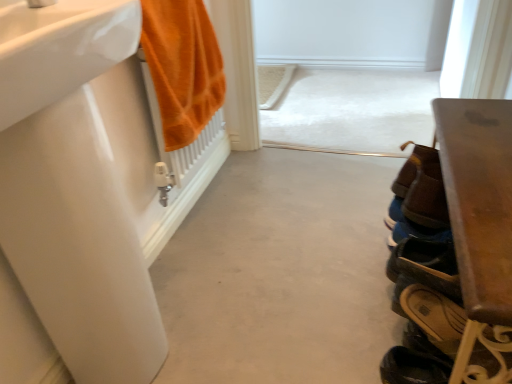
Where is `vacant point to the right of white glossy sink at left, which is counted as the 1th sink, starting from the bottom`? This screenshot has width=512, height=384. vacant point to the right of white glossy sink at left, which is counted as the 1th sink, starting from the bottom is located at coordinates (203, 342).